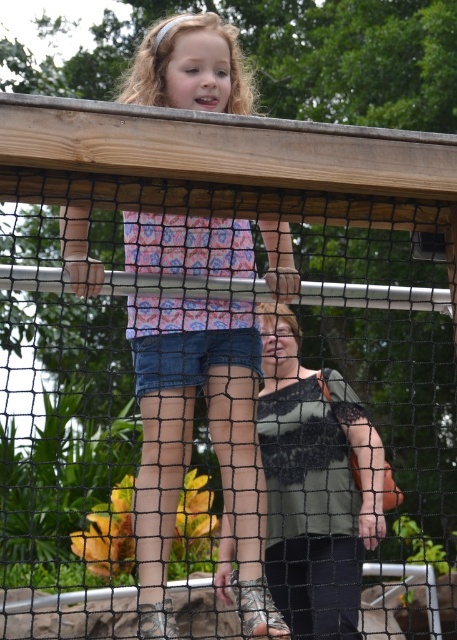
In the scene shown: You are a zookeeper who needs to place a 2.5 meter long ladder to reach the matte pink shirt at upper center from your current position. Is the distance sufficient?

The distance between you and the matte pink shirt at upper center is 4.02 meters, so the 2.5 meter ladder is not long enough to reach it. You need a longer ladder.

You are standing on the wooden bridge and want to hand a small toy to the girl. Which item, the matte pink shirt at upper center or the green lace tank top at center, is closer to you so you can reach it first?

The matte pink shirt at upper center is closer to the viewer than the green lace tank top at center, so you can reach the matte pink shirt at upper center first.

You are a zookeeper planning to place a small sign on the wooden bridge where the girl is standing. The sign needs to be placed at the point marked by the coordinates point (x=191, y=444). Where exactly on the bridge should the sign be placed?

The point (x=191, y=444) is located at the matte pink shirt at upper center, so the sign should be placed at the matte pink shirt at upper center on the bridge.